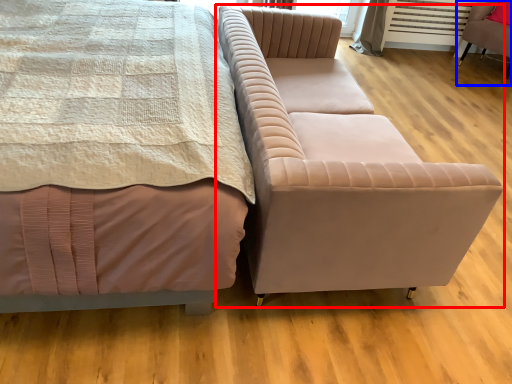
Question: Which object appears closest to the camera in this image, studio couch (highlighted by a red box) or chair (highlighted by a blue box)?

Choices:
 (A) studio couch
 (B) chair

Answer: (A)